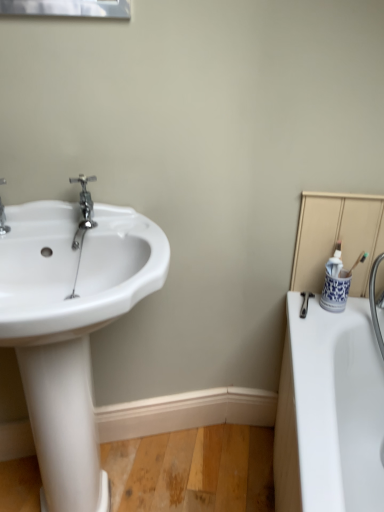
Identify the location of vacant position to the left of polished chrome faucet at left. This screenshot has height=512, width=384. (47, 225).